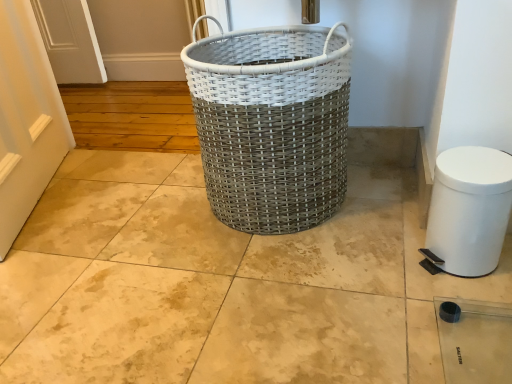
Question: From their relative heights in the image, would you say white woven basket at center is taller or shorter than white plastic trash can at lower right?

Choices:
 (A) short
 (B) tall

Answer: (B)

Question: Is white woven basket at center inside or outside of white plastic trash can at lower right?

Choices:
 (A) inside
 (B) outside

Answer: (B)

Question: From a real-world perspective, relative to white plastic trash can at lower right, is white woven basket at center vertically above or below?

Choices:
 (A) below
 (B) above

Answer: (B)

Question: Does point click(x=500, y=243) appear closer or farther from the camera than point click(x=207, y=99)?

Choices:
 (A) farther
 (B) closer

Answer: (B)

Question: In terms of size, does white plastic trash can at lower right appear bigger or smaller than white woven basket at center?

Choices:
 (A) small
 (B) big

Answer: (A)

Question: Is white plastic trash can at lower right taller or shorter than white woven basket at center?

Choices:
 (A) short
 (B) tall

Answer: (A)

Question: Is white plastic trash can at lower right situated inside white woven basket at center or outside?

Choices:
 (A) outside
 (B) inside

Answer: (A)